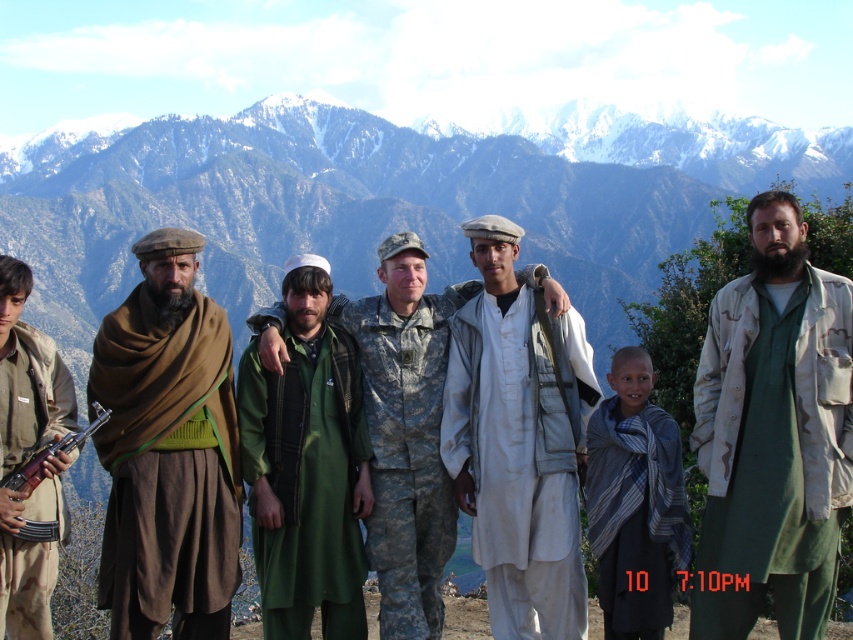
Does green cotton robe at right come in front of brown woolen shawl at left?

Yes, it is.

Between green cotton robe at right and brown woolen shawl at left, which one appears on the right side from the viewer's perspective?

Positioned to the right is green cotton robe at right.

I want to click on green cotton robe at right, so click(x=773, y=435).

Which of these two, snowy rock mountain range at upper center or white cotton shirt at center, stands taller?

snowy rock mountain range at upper center is taller.

Does snowy rock mountain range at upper center have a greater height compared to white cotton shirt at center?

Yes, snowy rock mountain range at upper center is taller than white cotton shirt at center.

Between point (351, 253) and point (488, 241), which one is positioned behind?

The point (351, 253) is more distant.

Find the location of `snowy rock mountain range at upper center`. snowy rock mountain range at upper center is located at coordinates (373, 204).

Is white cotton shirt at center wider than camouflage uniform at center?

Incorrect, white cotton shirt at center's width does not surpass camouflage uniform at center's.

Is point (483, 276) behind point (440, 481)?

That is True.

Does point (486, 282) lie behind point (404, 294)?

Yes.

Where is `white cotton shirt at center`? The image size is (853, 640). white cotton shirt at center is located at coordinates (518, 442).